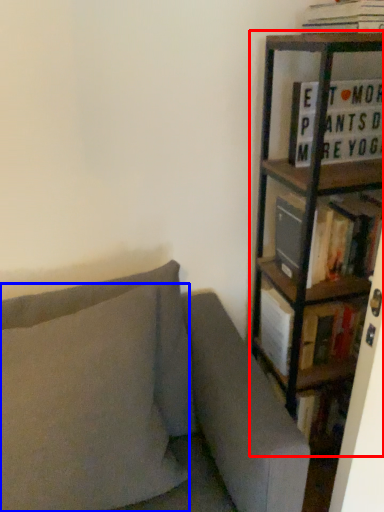
Question: Which point is further to the camera, bookcase (highlighted by a red box) or pillow (highlighted by a blue box)?

Choices:
 (A) bookcase
 (B) pillow

Answer: (A)